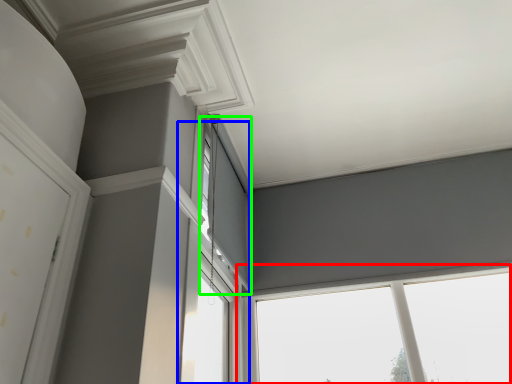
Question: Which object is positioned farthest from window (highlighted by a red box)? Select from window (highlighted by a blue box) and window (highlighted by a green box).

Choices:
 (A) window
 (B) window

Answer: (B)